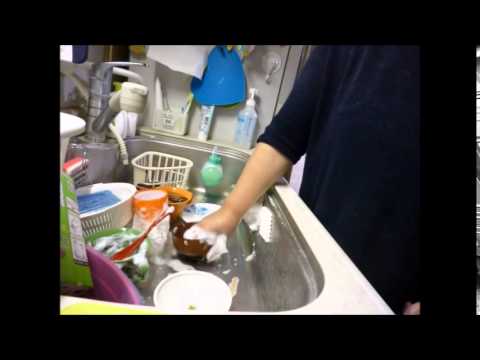
You are a GUI agent. You are given a task and a screenshot of the screen. Output one action in this format:
    pyautogui.click(x=<x>, y=<y>)
    Task: Click on the dirty dishes
    
    Given the screenshot: What is the action you would take?
    pyautogui.click(x=204, y=285), pyautogui.click(x=192, y=247), pyautogui.click(x=119, y=277), pyautogui.click(x=131, y=255), pyautogui.click(x=131, y=241), pyautogui.click(x=155, y=202), pyautogui.click(x=178, y=201)